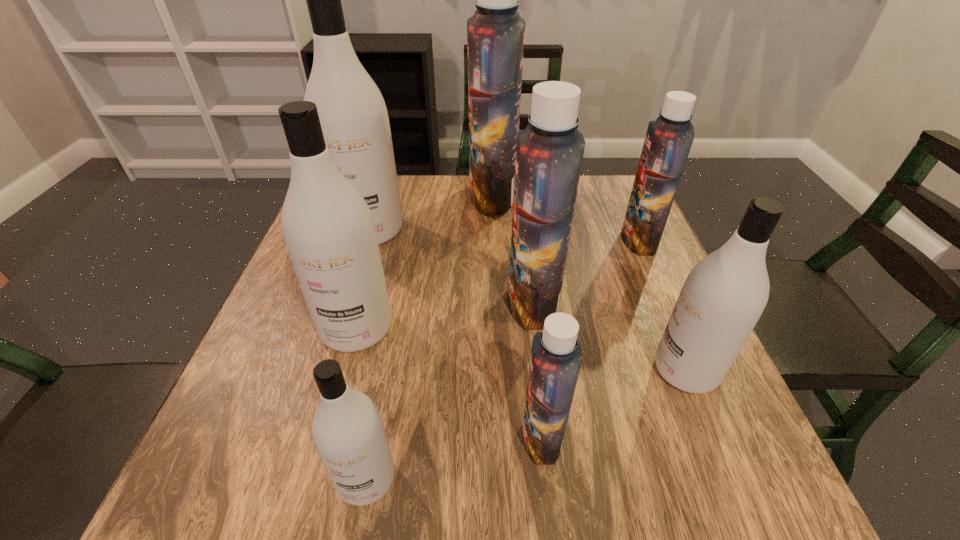
At what (x,y) coordinates should I click in order to perform the action: click on free location located 0.170m on the front-facing side of the rightmost white shampoo. Please return your answer as a coordinate pair (x, y). This screenshot has height=540, width=960. Looking at the image, I should click on (562, 370).

I want to click on free location located on the front-facing side of the rightmost white shampoo, so click(x=530, y=370).

You are a GUI agent. You are given a task and a screenshot of the screen. Output one action in this format:
    pyautogui.click(x=<x>, y=<y>)
    Task: Click on the vacant space located on the front-facing side of the rightmost white shampoo
    The height and width of the screenshot is (540, 960).
    Given the screenshot: What is the action you would take?
    pyautogui.click(x=540, y=370)

This screenshot has width=960, height=540. Identify the location of vacant position located 0.130m on the front label of the smallest blue shampoo. click(442, 436).

Find the location of a particular element. The image size is (960, 540). vacant space situated 0.260m on the front label of the smallest blue shampoo is located at coordinates (362, 436).

The image size is (960, 540). I want to click on free space located 0.120m on the front label of the smallest blue shampoo, so click(448, 436).

This screenshot has height=540, width=960. Find the location of `object situated at the far left corner`. object situated at the far left corner is located at coordinates (353, 116).

Image resolution: width=960 pixels, height=540 pixels. I want to click on free region at the near edge of the desktop, so click(612, 496).

Locate an element on the screen. vacant space at the left edge of the desktop is located at coordinates (219, 420).

What are the coordinates of `blank area at the right edge` in the screenshot? It's located at (651, 445).